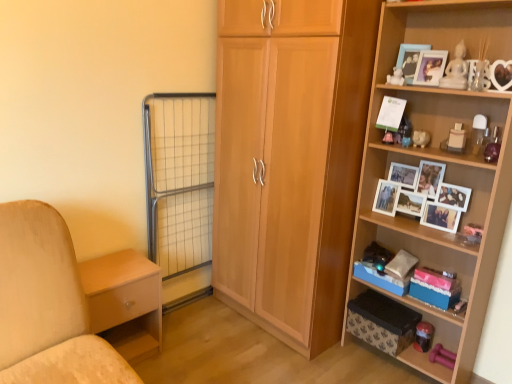
This screenshot has width=512, height=384. I want to click on free location to the left of wooden shelf at right, the 1th shelf ordered from the bottom, so click(338, 368).